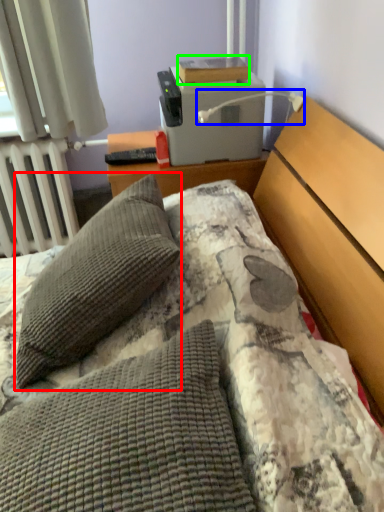
Question: Estimate the real-world distances between objects in this image. Which object is farther from pillow (highlighted by a red box), lamp (highlighted by a blue box) or book (highlighted by a green box)?

Choices:
 (A) lamp
 (B) book

Answer: (B)